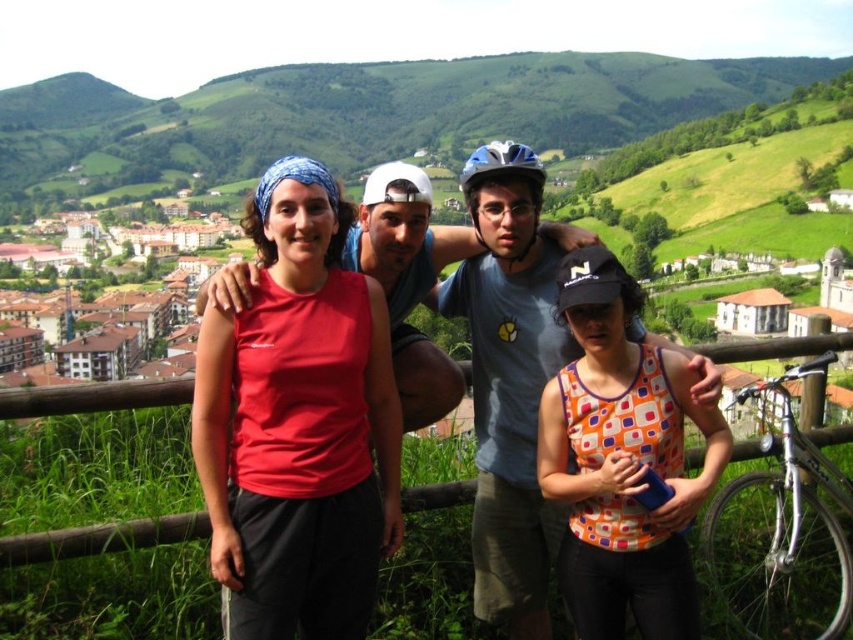
You are planning to place a decorative item on a table that can only hold items smaller than the silver metallic helmet at center. You have the wooden at center available. Will it fit?

The wooden at center is smaller than the silver metallic helmet at center, so it will fit on the table.

You are a photographer trying to capture a group photo of the two women and two men in the scene. The orange printed tank top at center and the blue matte bicycle helmet at center are both in the frame. If you want to ensure both objects are clearly visible, which object should you focus on first considering their sizes?

The orange printed tank top at center has a smaller width compared to the blue matte bicycle helmet at center. Therefore, you should focus on the blue matte bicycle helmet at center first since it is larger and more prominent in the frame.